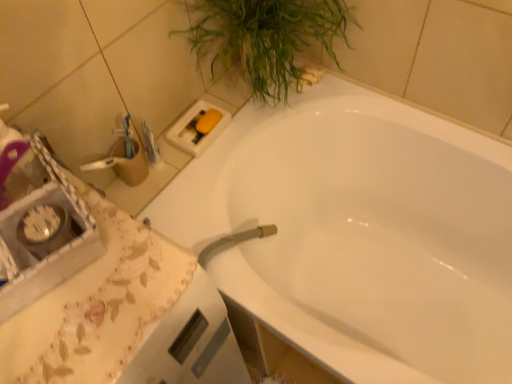
Question: Does white fabric at lower left appear on the left side of green leafy plant at upper right?

Choices:
 (A) yes
 (B) no

Answer: (A)

Question: Are white fabric at lower left and green leafy plant at upper right far apart?

Choices:
 (A) no
 (B) yes

Answer: (A)

Question: From a real-world perspective, is white fabric at lower left located higher than green leafy plant at upper right?

Choices:
 (A) no
 (B) yes

Answer: (A)

Question: Can you confirm if white fabric at lower left is shorter than green leafy plant at upper right?

Choices:
 (A) no
 (B) yes

Answer: (A)

Question: From the image's perspective, does white fabric at lower left appear lower than green leafy plant at upper right?

Choices:
 (A) yes
 (B) no

Answer: (A)

Question: Relative to white fabric at lower left, is white glossy bathtub at upper center in front or behind?

Choices:
 (A) behind
 (B) front

Answer: (A)

Question: Considering the relative positions of white glossy bathtub at upper center and white fabric at lower left in the image provided, is white glossy bathtub at upper center to the left or to the right of white fabric at lower left?

Choices:
 (A) right
 (B) left

Answer: (A)

Question: Considering the positions of white glossy bathtub at upper center and white fabric at lower left in the image, is white glossy bathtub at upper center taller or shorter than white fabric at lower left?

Choices:
 (A) short
 (B) tall

Answer: (A)

Question: In terms of width, does white glossy bathtub at upper center look wider or thinner when compared to white fabric at lower left?

Choices:
 (A) thin
 (B) wide

Answer: (B)

Question: Is white fabric at lower left inside or outside of white glossy bathtub at upper center?

Choices:
 (A) outside
 (B) inside

Answer: (A)

Question: Considering the positions of white fabric at lower left and white glossy bathtub at upper center in the image, is white fabric at lower left wider or thinner than white glossy bathtub at upper center?

Choices:
 (A) wide
 (B) thin

Answer: (B)

Question: Considering the positions of point (102, 355) and point (408, 140), is point (102, 355) closer or farther from the camera than point (408, 140)?

Choices:
 (A) closer
 (B) farther

Answer: (A)

Question: Would you say white fabric at lower left is to the left or to the right of white glossy bathtub at upper center in the picture?

Choices:
 (A) left
 (B) right

Answer: (A)

Question: Based on their positions, is white glossy bathtub at upper center located to the left or right of green leafy plant at upper right?

Choices:
 (A) right
 (B) left

Answer: (A)

Question: From the image's perspective, relative to green leafy plant at upper right, is white glossy bathtub at upper center above or below?

Choices:
 (A) below
 (B) above

Answer: (A)